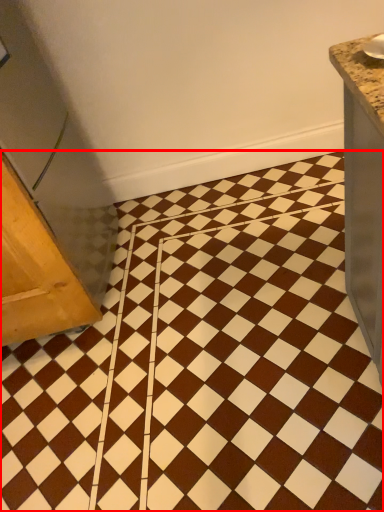
Question: Where is ceramic tile (annotated by the red box) located in relation to furniture in the image?

Choices:
 (A) right
 (B) left

Answer: (A)